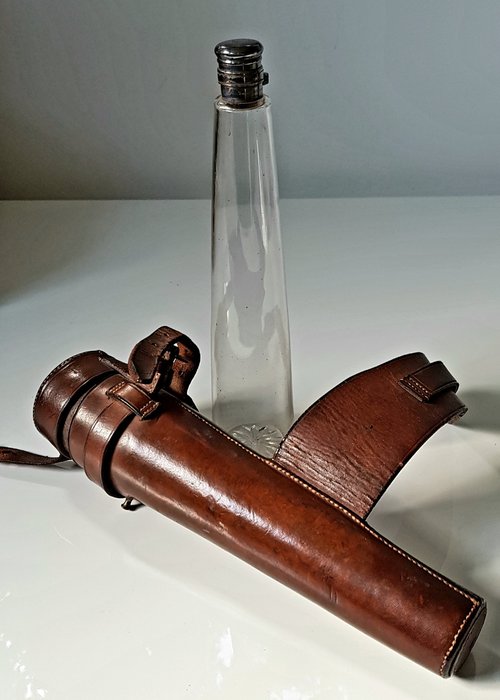
Identify the location of wall. (342, 148).